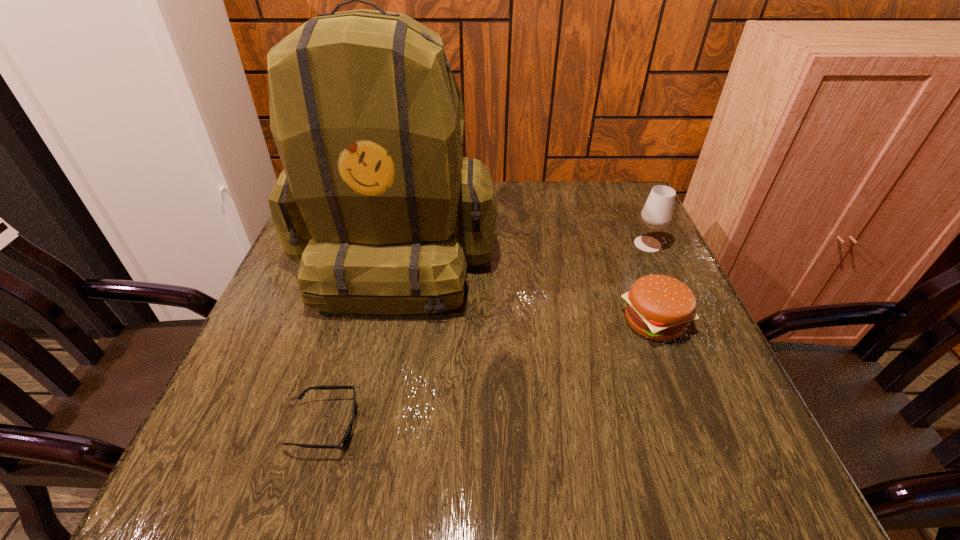
What are the coordinates of `blank space at the right edge` in the screenshot? It's located at (628, 248).

Where is `free space at the near left corner`? The image size is (960, 540). free space at the near left corner is located at coordinates (272, 453).

You are a GUI agent. You are given a task and a screenshot of the screen. Output one action in this format:
    pyautogui.click(x=<x>, y=<y>)
    Task: Click on the vacant space at the far right corner
    
    Given the screenshot: What is the action you would take?
    pyautogui.click(x=616, y=185)

Find the location of a particular element. Image resolution: width=960 pixels, height=540 pixels. vacant region between the shortest object and the glass is located at coordinates (487, 335).

Locate an element on the screen. free space between the shortest object and the second shortest object is located at coordinates coord(490,374).

In order to click on free space between the backpack and the glass in this screenshot , I will do pos(522,247).

Identify the location of vacant point located between the hamburger and the sunglasses. This screenshot has height=540, width=960. (490, 374).

I want to click on vacant area that lies between the hamburger and the sunglasses, so click(x=490, y=374).

What are the coordinates of `free spot between the tallest object and the shortest object` in the screenshot? It's located at (361, 338).

The width and height of the screenshot is (960, 540). In order to click on vacant space that is in between the glass and the sunglasses in this screenshot , I will do `click(487, 335)`.